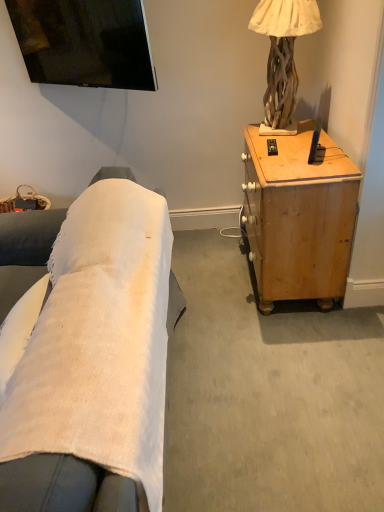
The height and width of the screenshot is (512, 384). What are the coordinates of `free region on the left part of black plastic remote control at upper right` in the screenshot? It's located at (256, 151).